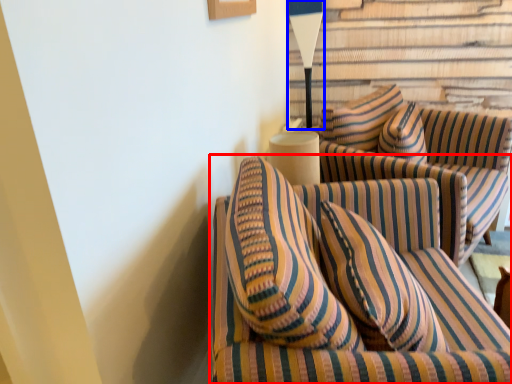
Question: Which point is further to the camera, studio couch (highlighted by a red box) or table lamp (highlighted by a blue box)?

Choices:
 (A) studio couch
 (B) table lamp

Answer: (B)